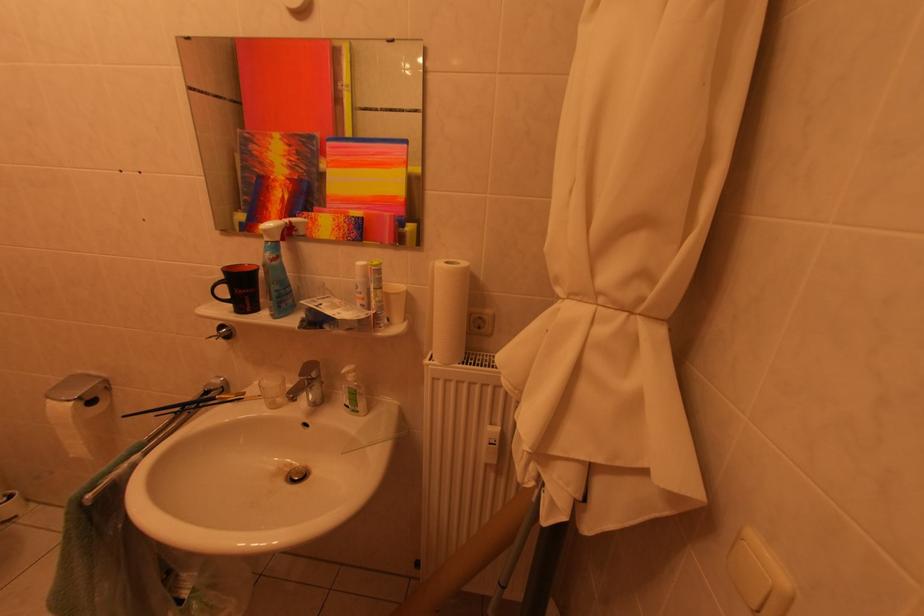
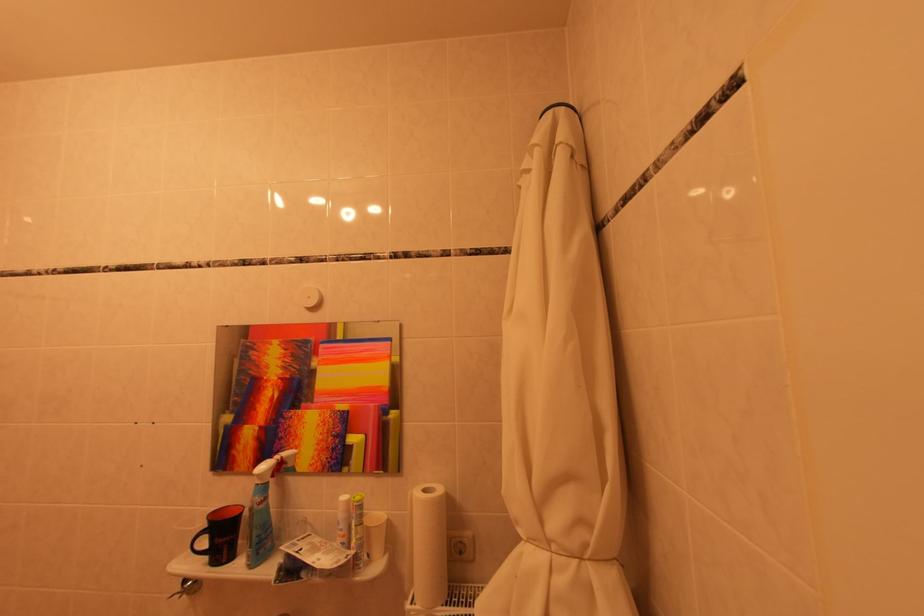
Locate, in the second image, the point that corresponds to (x=489, y=322) in the first image.

(468, 546)